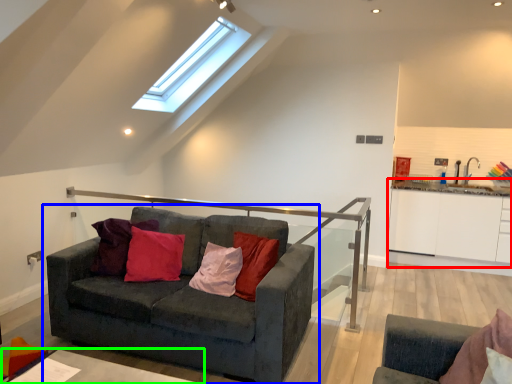
Question: Which object is the farthest from cabinetry (highlighted by a red box)? Choose among these: studio couch (highlighted by a blue box) or table (highlighted by a green box).

Choices:
 (A) studio couch
 (B) table

Answer: (B)